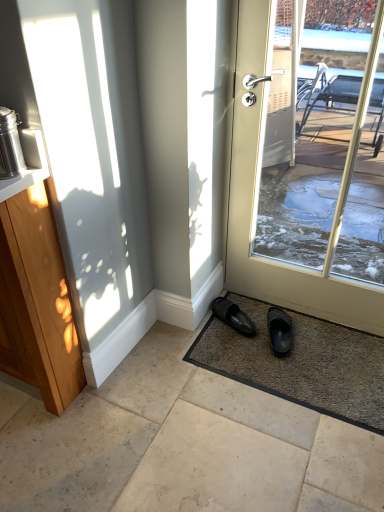
In order to click on free spot behind black rubber slipper at lower right, which appears as the second footwear when viewed from the left in this screenshot , I will do `click(263, 310)`.